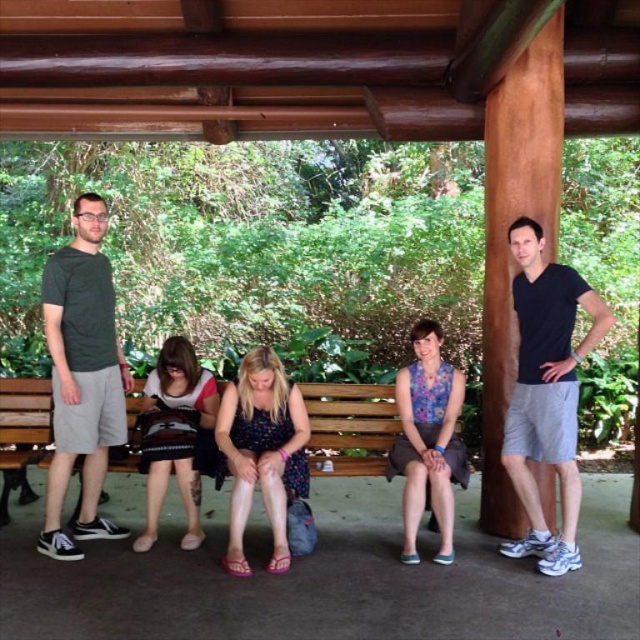
Question: Which point is closer to the camera?

Choices:
 (A) (588, 339)
 (B) (371, 454)
 (C) (92, 502)

Answer: (A)

Question: Can you confirm if black cotton t-shirt at center is bigger than wooden bench at center?

Choices:
 (A) yes
 (B) no

Answer: (A)

Question: Is black cotton t-shirt at center below wooden bench at center?

Choices:
 (A) no
 (B) yes

Answer: (A)

Question: Which object is closer to the camera taking this photo?

Choices:
 (A) black cotton t-shirt at center
 (B) wooden bench at center

Answer: (A)

Question: Is matte black t-shirt at left smaller than wooden bench at center?

Choices:
 (A) yes
 (B) no

Answer: (B)

Question: Which point is farther from the camera taking this photo?

Choices:
 (A) (342, 401)
 (B) (522, 472)

Answer: (A)